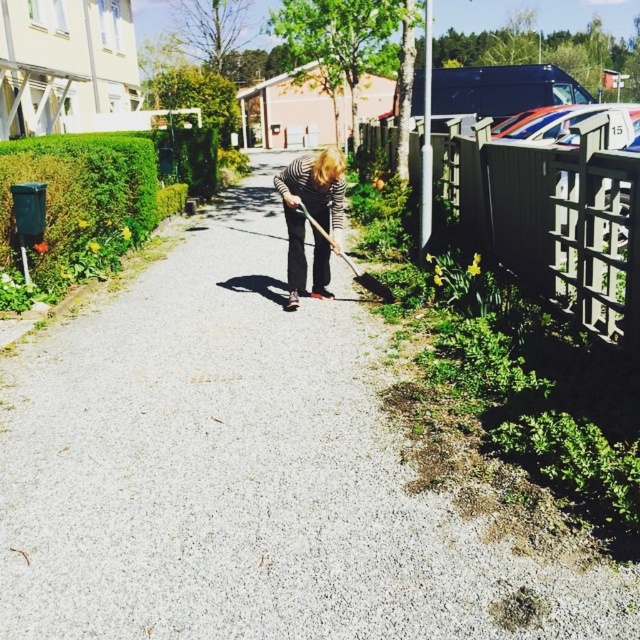
Is green leafy hedge at left to the right of striped fabric person at center from the viewer's perspective?

In fact, green leafy hedge at left is to the left of striped fabric person at center.

Is green leafy hedge at left above striped fabric person at center?

Indeed, green leafy hedge at left is positioned over striped fabric person at center.

Is point (138, 196) farther from camera compared to point (337, 150)?

Yes, it is behind point (337, 150).

Identify the location of green leafy hedge at left. This screenshot has width=640, height=640. (80, 196).

Does green leafy hedge at left lie in front of wooden shovel at center?

No, green leafy hedge at left is further to the viewer.

Between point (68, 192) and point (378, 289), which one is positioned behind?

Point (68, 192)

This screenshot has width=640, height=640. Describe the element at coordinates (80, 196) in the screenshot. I see `green leafy hedge at left` at that location.

This screenshot has width=640, height=640. I want to click on green leafy hedge at left, so click(x=80, y=196).

Between green metal fence at right and green leafy hedge at left, which one has more height?

Standing taller between the two is green leafy hedge at left.

Is green metal fence at right smaller than green leafy hedge at left?

Yes, green metal fence at right is smaller than green leafy hedge at left.

Is point (461, 186) positioned after point (88, 186)?

Yes, point (461, 186) is behind point (88, 186).

Where is `green metal fence at right`? Image resolution: width=640 pixels, height=640 pixels. green metal fence at right is located at coordinates (552, 220).